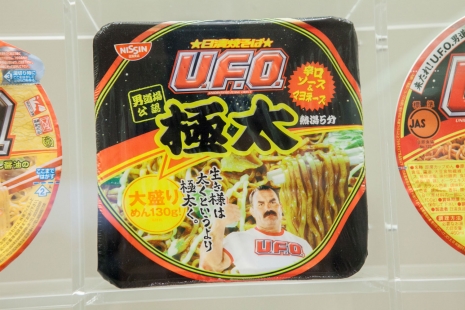
This screenshot has width=465, height=310. Identify the location of tan tile. (67, 279).